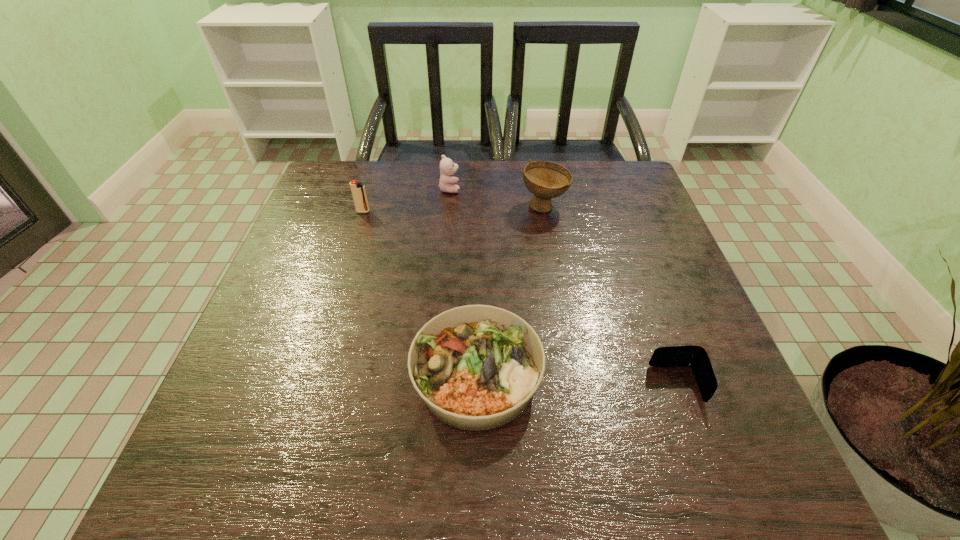
Where is `free space at the far left corner of the desktop`? free space at the far left corner of the desktop is located at coordinates (365, 162).

The image size is (960, 540). Identify the location of vacant space at the far right corner. (632, 172).

Where is `free region at the near right corner`? This screenshot has height=540, width=960. free region at the near right corner is located at coordinates (727, 471).

Locate an element on the screen. free space that is in between the igniter and the wallet is located at coordinates (519, 298).

Locate an element on the screen. free space between the salad plate and the soup bowl is located at coordinates (511, 291).

I want to click on unoccupied area between the teddy bear and the soup bowl, so click(497, 198).

Locate an element on the screen. This screenshot has width=960, height=540. empty space between the salad plate and the soup bowl is located at coordinates (511, 291).

Where is `free space between the soup bowl and the salad plate`? free space between the soup bowl and the salad plate is located at coordinates (511, 291).

In order to click on vacant area that lies between the soup bowl and the shortest object in this screenshot , I will do `click(611, 295)`.

This screenshot has height=540, width=960. I want to click on free space between the teddy bear and the leftmost object, so click(x=406, y=200).